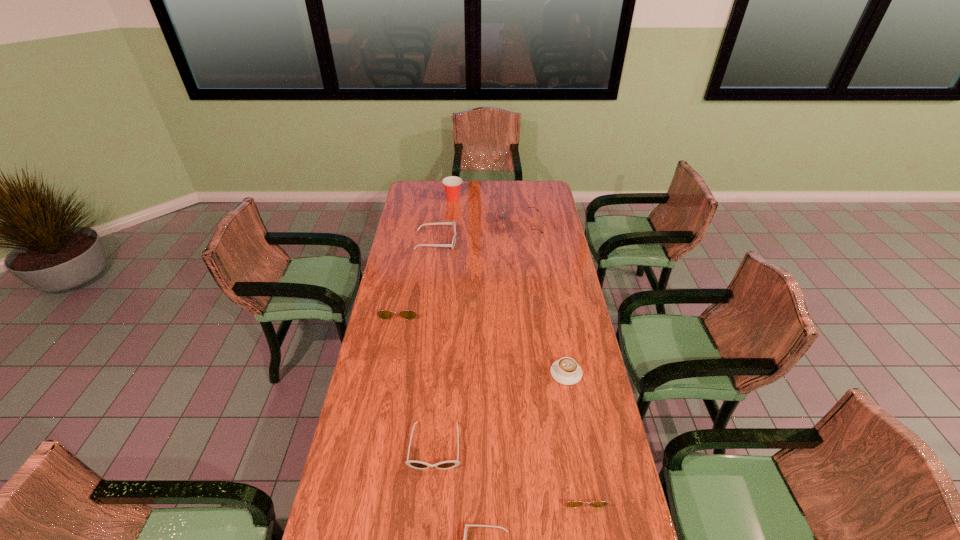
Identify the location of free region at the far edge of the desktop. (488, 184).

Find the location of a particular element. free location at the left edge of the desktop is located at coordinates (393, 323).

The width and height of the screenshot is (960, 540). Identify the location of free space at the right edge. (529, 205).

Where is `vacant space at the far left corner`? The width and height of the screenshot is (960, 540). vacant space at the far left corner is located at coordinates (432, 196).

Where is `vacant space at the far right corner`? This screenshot has width=960, height=540. vacant space at the far right corner is located at coordinates (524, 180).

Locate an element on the screen. This screenshot has height=540, width=960. free spot between the leftmost green sunglasses and the farthest green sunglasses is located at coordinates (461, 266).

Where is `unoccupied area between the second nearest black sunglasses and the fourth nearest sunglasses`? This screenshot has height=540, width=960. unoccupied area between the second nearest black sunglasses and the fourth nearest sunglasses is located at coordinates (418, 376).

You are a GUI agent. You are given a task and a screenshot of the screen. Output one action in this format:
    pyautogui.click(x=<x>, y=<y>)
    Task: Click on the empty space between the biggest green sunglasses and the smallest green sunglasses
    The height and width of the screenshot is (540, 960).
    Given the screenshot: What is the action you would take?
    pyautogui.click(x=552, y=356)

Image resolution: width=960 pixels, height=540 pixels. I want to click on vacant area that lies between the fifth farthest object and the leftmost green sunglasses, so click(483, 340).

What are the coordinates of `free space between the cappuccino and the second farthest black sunglasses` in the screenshot? It's located at (500, 409).